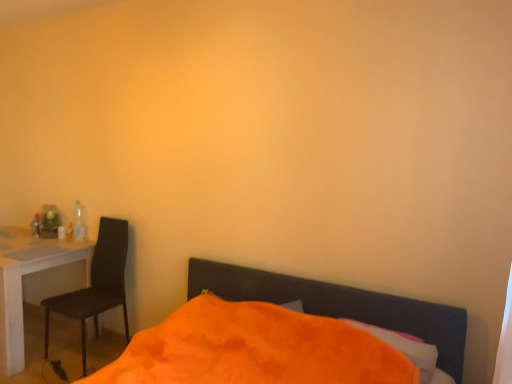
Find the location of a particular element. The width and height of the screenshot is (512, 384). vacant point above orange soft pillow at lower center (from a real-world perspective) is located at coordinates (372, 333).